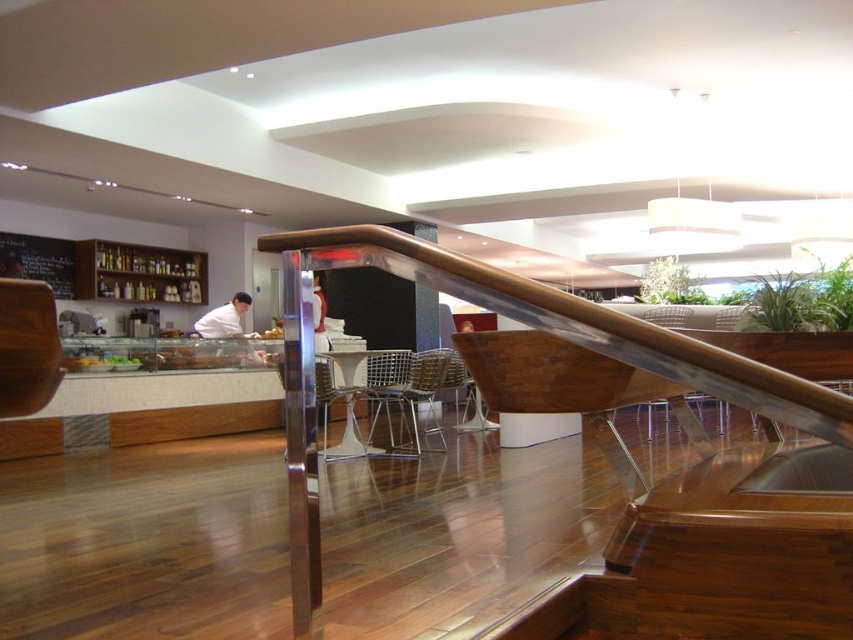
Question: Does polished stainless steel handrail at center appear on the right side of wooden pillar at center?

Choices:
 (A) yes
 (B) no

Answer: (A)

Question: Which point is farther from the camera taking this photo?

Choices:
 (A) (734, 374)
 (B) (386, 416)
 (C) (325, 449)

Answer: (B)

Question: Is polished stainless steel handrail at center to the right of metallic silver chair at center from the viewer's perspective?

Choices:
 (A) yes
 (B) no

Answer: (A)

Question: Which object is farther from the camera taking this photo?

Choices:
 (A) polished stainless steel handrail at center
 (B) wooden pillar at center
 (C) metallic silver chair at center
 (D) metallic mesh chair at center

Answer: (B)

Question: Which of the following is the farthest from the observer?

Choices:
 (A) polished stainless steel handrail at center
 (B) metallic silver chair at center
 (C) metallic mesh chair at center

Answer: (C)

Question: Does polished stainless steel handrail at center appear on the left side of wooden pillar at center?

Choices:
 (A) no
 (B) yes

Answer: (A)